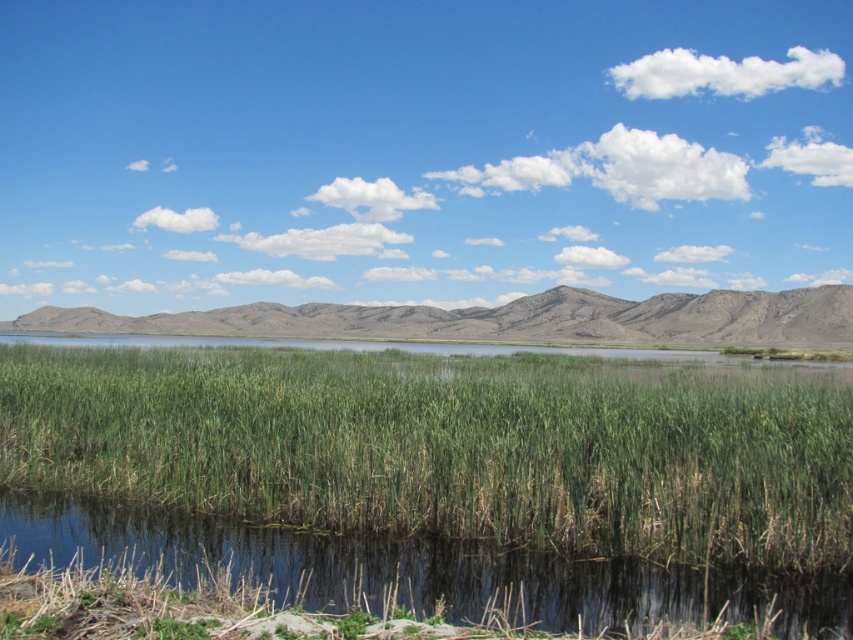
Question: Is green grass at lower center smaller than gray/dry grassy at center?

Choices:
 (A) yes
 (B) no

Answer: (A)

Question: Does green grass at lower center appear on the left side of green grassy pond at lower center?

Choices:
 (A) no
 (B) yes

Answer: (B)

Question: Estimate the real-world distances between objects in this image. Which object is closer to the green grassy pond at lower center?

Choices:
 (A) green grass at lower center
 (B) gray/dry grassy at center

Answer: (A)

Question: Does green grassy pond at lower center appear over gray/dry grassy at center?

Choices:
 (A) no
 (B) yes

Answer: (A)

Question: Which point is closer to the camera?

Choices:
 (A) gray/dry grassy at center
 (B) green grass at lower center

Answer: (B)

Question: Which object is positioned closest to the green grassy pond at lower center?

Choices:
 (A) green grass at lower center
 (B) gray/dry grassy at center

Answer: (A)